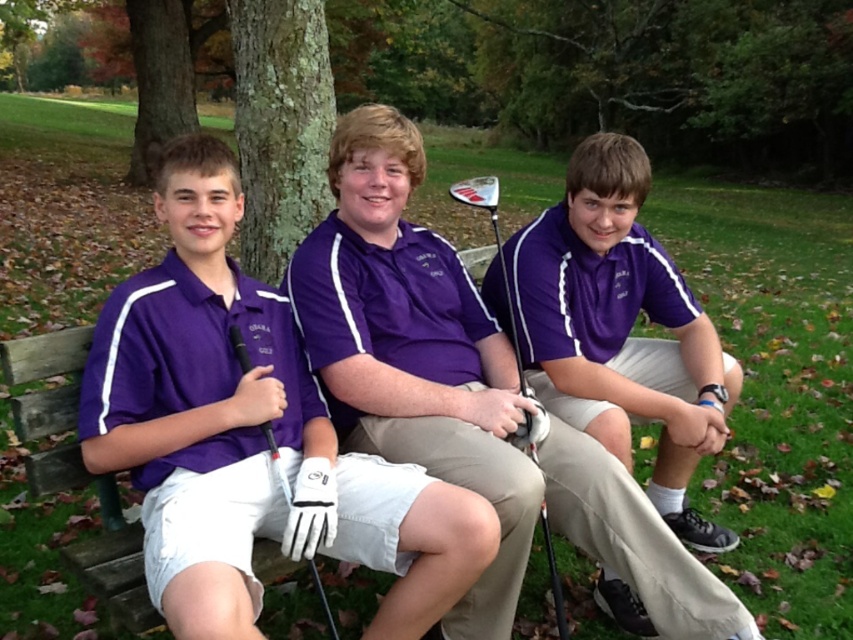
Question: Among these points, which one is nearest to the camera?

Choices:
 (A) (306, 563)
 (B) (469, 204)
 (C) (701, 381)
 (D) (654, 621)

Answer: (A)

Question: Does purple matte golf club at center have a smaller size compared to black rubber golf club at center?

Choices:
 (A) no
 (B) yes

Answer: (A)

Question: Which object is farther from the camera taking this photo?

Choices:
 (A) black rubber golf club at center
 (B) purple cotton polo shirt at center
 (C) matte white golf club at center

Answer: (B)

Question: Can you confirm if purple matte golf club at center is positioned to the right of purple cotton polo shirt at center?

Choices:
 (A) yes
 (B) no

Answer: (B)

Question: Can you confirm if matte white golf club at center is bigger than black rubber golf club at center?

Choices:
 (A) yes
 (B) no

Answer: (A)

Question: Which point is closer to the camera?

Choices:
 (A) (306, 560)
 (B) (695, 380)
 (C) (521, 390)

Answer: (A)